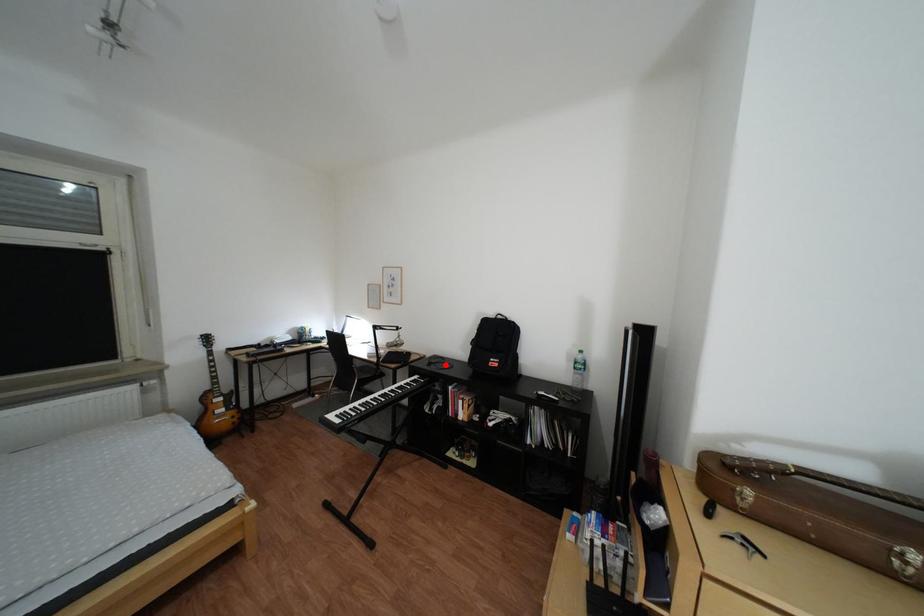
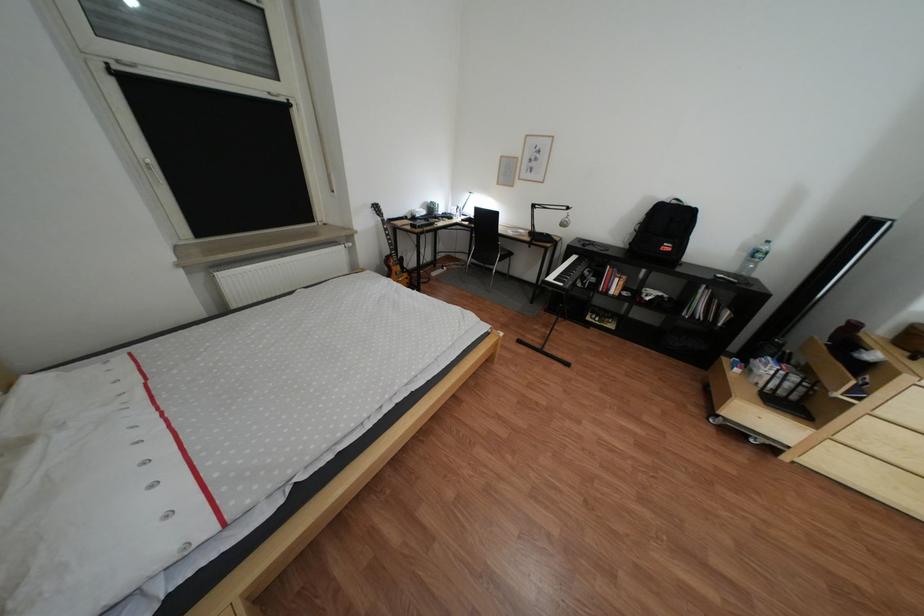
Locate, in the second image, the point that corresponds to the highlighted location in the first image.

(600, 246)